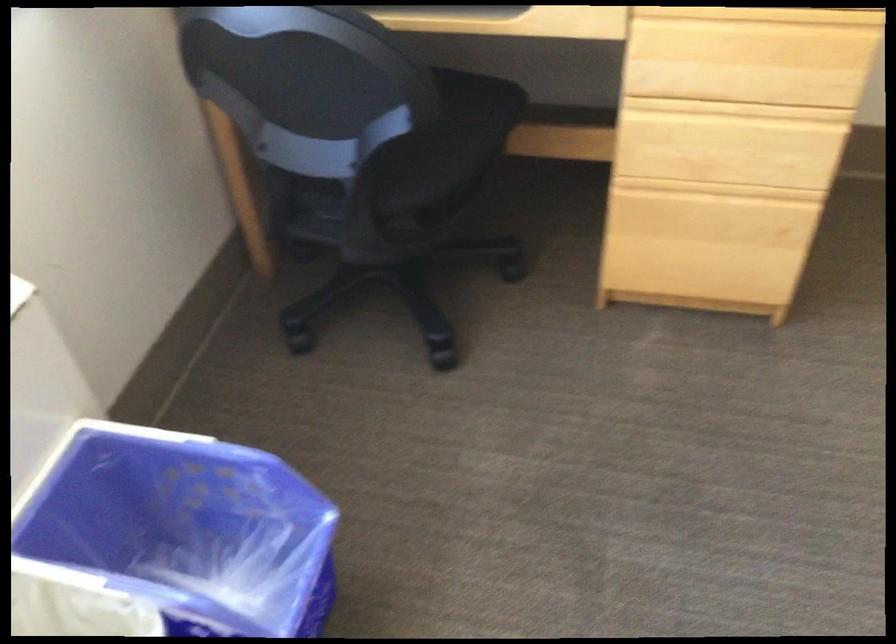
Identify the location of chair sitting surface. Image resolution: width=896 pixels, height=644 pixels. (452, 142).